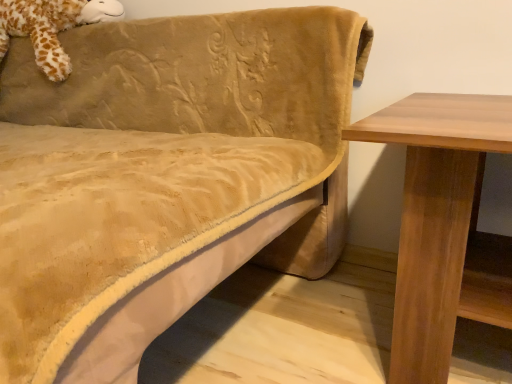
Question: From a real-world perspective, is fluffy brown giraffe at upper left located beneath velvet beige couch at upper left?

Choices:
 (A) yes
 (B) no

Answer: (B)

Question: Can you confirm if fluffy brown giraffe at upper left is shorter than velvet beige couch at upper left?

Choices:
 (A) yes
 (B) no

Answer: (A)

Question: Is fluffy brown giraffe at upper left oriented away from velvet beige couch at upper left?

Choices:
 (A) yes
 (B) no

Answer: (A)

Question: Is fluffy brown giraffe at upper left further to the viewer compared to velvet beige couch at upper left?

Choices:
 (A) yes
 (B) no

Answer: (A)

Question: From a real-world perspective, is fluffy brown giraffe at upper left over velvet beige couch at upper left?

Choices:
 (A) yes
 (B) no

Answer: (A)

Question: Does fluffy brown giraffe at upper left touch velvet beige couch at upper left?

Choices:
 (A) yes
 (B) no

Answer: (B)

Question: From the image's perspective, is velvet beige couch at upper left over fluffy brown giraffe at upper left?

Choices:
 (A) no
 (B) yes

Answer: (A)

Question: Does velvet beige couch at upper left have a lesser width compared to fluffy brown giraffe at upper left?

Choices:
 (A) no
 (B) yes

Answer: (A)

Question: Is fluffy brown giraffe at upper left surrounded by velvet beige couch at upper left?

Choices:
 (A) yes
 (B) no

Answer: (A)

Question: Is velvet beige couch at upper left at the right side of fluffy brown giraffe at upper left?

Choices:
 (A) yes
 (B) no

Answer: (A)

Question: Considering the relative sizes of velvet beige couch at upper left and fluffy brown giraffe at upper left in the image provided, is velvet beige couch at upper left shorter than fluffy brown giraffe at upper left?

Choices:
 (A) yes
 (B) no

Answer: (B)

Question: Is fluffy brown giraffe at upper left at the back of velvet beige couch at upper left?

Choices:
 (A) no
 (B) yes

Answer: (B)

Question: Looking at the image, does velvet beige couch at upper left seem bigger or smaller compared to fluffy brown giraffe at upper left?

Choices:
 (A) small
 (B) big

Answer: (B)